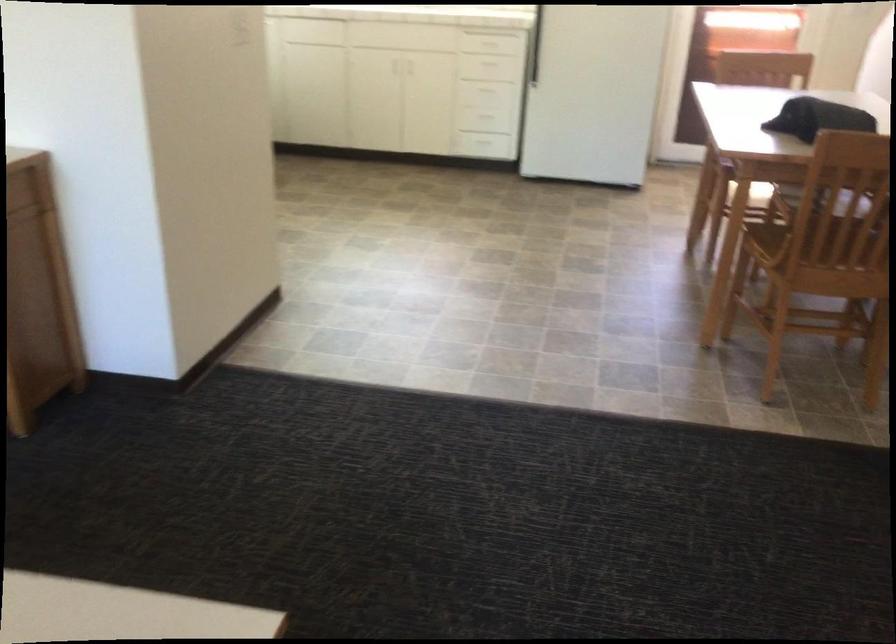
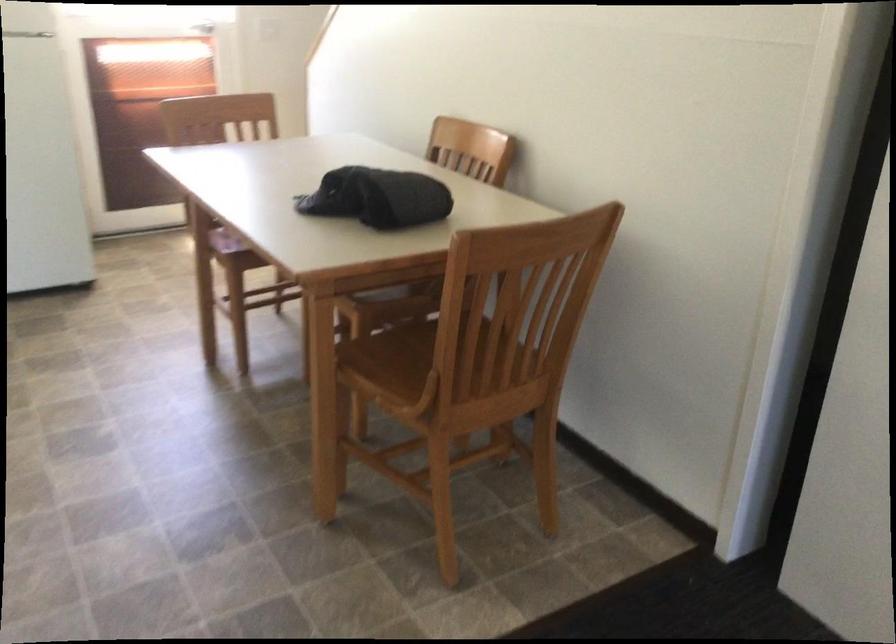
The point at (814, 243) is marked in the first image. Where is the corresponding point in the second image?

(421, 361)